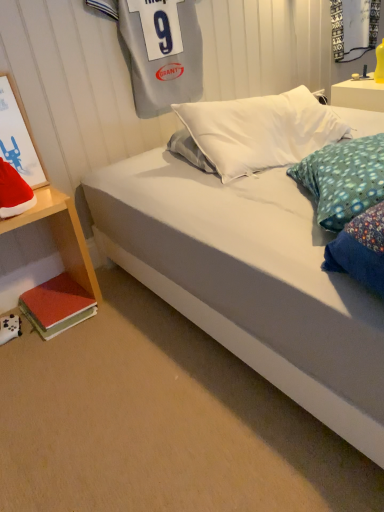
Where is `vacant point above red matte book at lower left (from a real-world perspective)`? This screenshot has height=512, width=384. vacant point above red matte book at lower left (from a real-world perspective) is located at coordinates (61, 293).